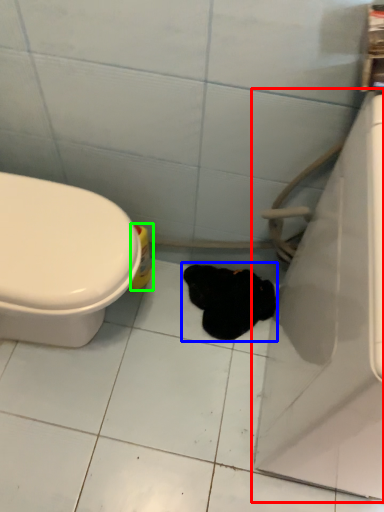
Question: Estimate the real-world distances between objects in this image. Which object is farther from bath (highlighted by a red box), animal (highlighted by a blue box) or cleaning product (highlighted by a green box)?

Choices:
 (A) animal
 (B) cleaning product

Answer: (B)